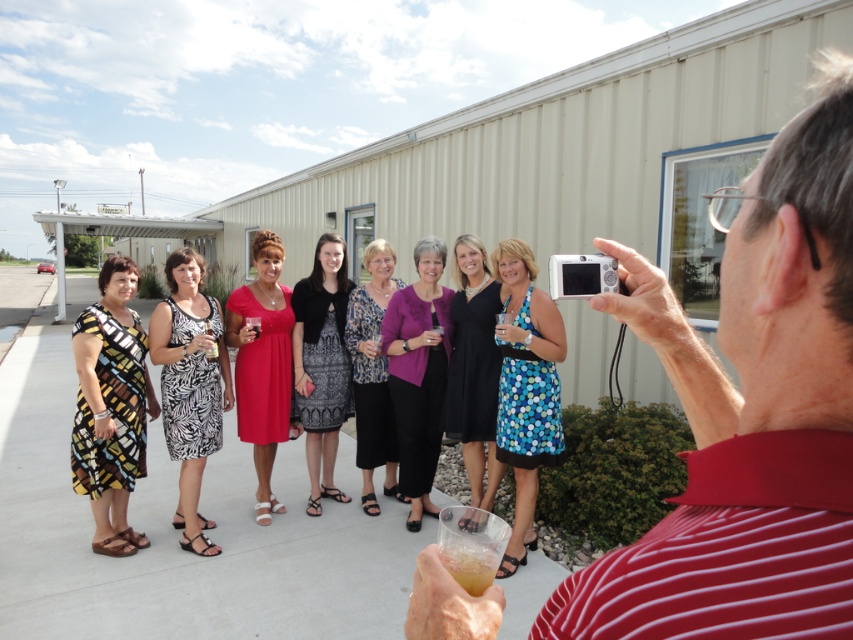
Based on the photo, you are a photographer at the event and want to ensure both the printed fabric dress at center and the blue dotted dress at center are visible in the photo. Which dress might you need to adjust the camera angle to include more of its hemline?

The blue dotted dress at center is longer than the printed fabric dress at center, so you might need to adjust the camera angle to include more of its hemline.

You are a photographer standing near the man in the red striped shirt. You need to adjust the camera angle to focus on the printed fabric dress at center and the translucent plastic cup at lower center. Which object should you move the camera up to better capture?

The printed fabric dress at center is below the translucent plastic cup at lower center, so to better capture both, you should move the camera up to include the printed fabric dress at center which is positioned lower in the frame.

You are standing in the scene and want to move from the point at coordinates point (123, 502) to the point at coordinates point (543, 460). Which direction should you face to walk towards the second point?

Since point (123, 502) is closer to you than point (543, 460), you should face away from yourself towards the point (543, 460) to walk towards it.